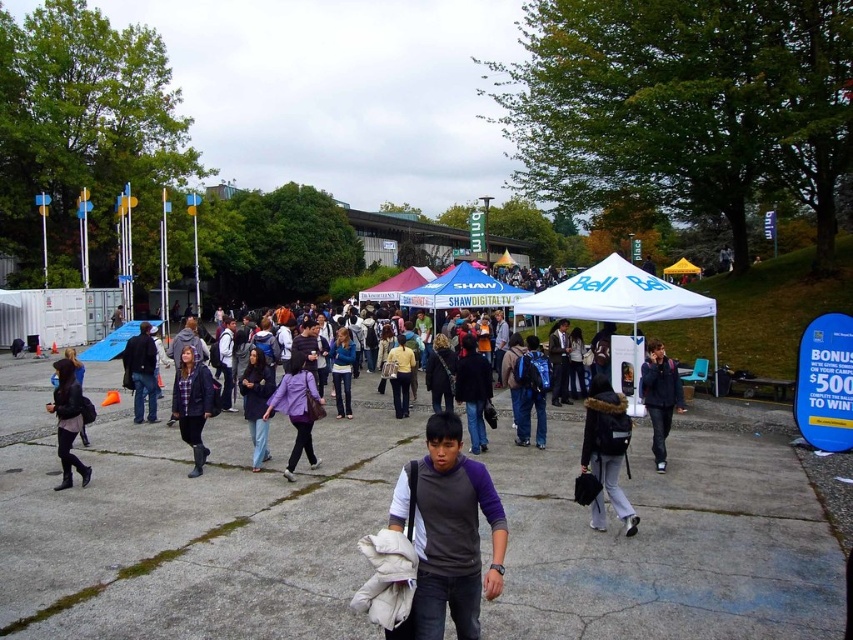
Measure the distance between white fabric tent at center and camera.

They are 12.73 meters apart.

Can you confirm if white fabric tent at center is positioned to the left of matte black jacket at left?

No, white fabric tent at center is not to the left of matte black jacket at left.

Which is in front, point (622, 289) or point (62, 422)?

Point (62, 422) is in front.

Locate an element on the screen. white fabric tent at center is located at coordinates (619, 298).

Identify the location of dark blue jacket at center. (193, 403).

Does point (190, 349) come closer to viewer compared to point (242, 403)?

Yes.

You are a GUI agent. You are given a task and a screenshot of the screen. Output one action in this format:
    pyautogui.click(x=<x>, y=<y>)
    Task: Click on the dark blue jacket at center
    
    Given the screenshot: What is the action you would take?
    pyautogui.click(x=193, y=403)

Is dark blue jacket at center wider than purple matte jacket at center?

No.

Can you confirm if dark blue jacket at center is positioned above purple matte jacket at center?

Yes.

Find the location of `dark blue jacket at center`. dark blue jacket at center is located at coordinates (193, 403).